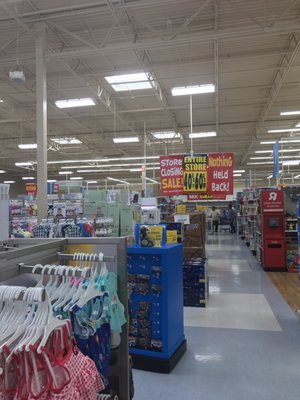
Image resolution: width=300 pixels, height=400 pixels. I want to click on columns, so click(x=43, y=172), click(x=143, y=176).